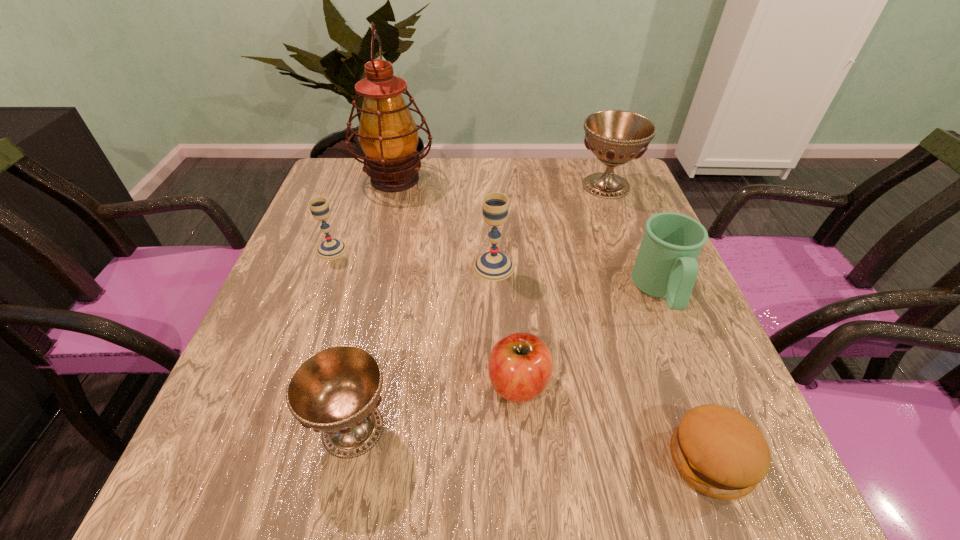
Locate an element on the screen. vacant region located 0.180m on the left of the brown hamburger is located at coordinates (553, 460).

Locate an element on the screen. The height and width of the screenshot is (540, 960). oil lamp located at the far edge is located at coordinates (388, 135).

At what (x,y) coordinates should I click in order to perform the action: click on chalice that is positioned at the far edge. Please return your answer as a coordinate pair (x, y). The width and height of the screenshot is (960, 540). Looking at the image, I should click on (615, 137).

The image size is (960, 540). Find the location of `chalice that is at the near edge`. chalice that is at the near edge is located at coordinates (336, 390).

Find the location of a particular element. This screenshot has height=540, width=960. hamburger at the near edge is located at coordinates (717, 450).

You are a GUI agent. You are given a task and a screenshot of the screen. Output one action in this format:
    pyautogui.click(x=<x>, y=<y>)
    Task: Click on the oil lamp at the left edge
    The width and height of the screenshot is (960, 540).
    Given the screenshot: What is the action you would take?
    pyautogui.click(x=388, y=135)

In order to click on chalice present at the left edge in this screenshot , I will do `click(330, 249)`.

Identify the location of chalice that is at the right edge. The height and width of the screenshot is (540, 960). (615, 137).

Where is `mug at the right edge`? This screenshot has height=540, width=960. mug at the right edge is located at coordinates (666, 266).

Where is `hamburger that is at the right edge`? hamburger that is at the right edge is located at coordinates (717, 450).